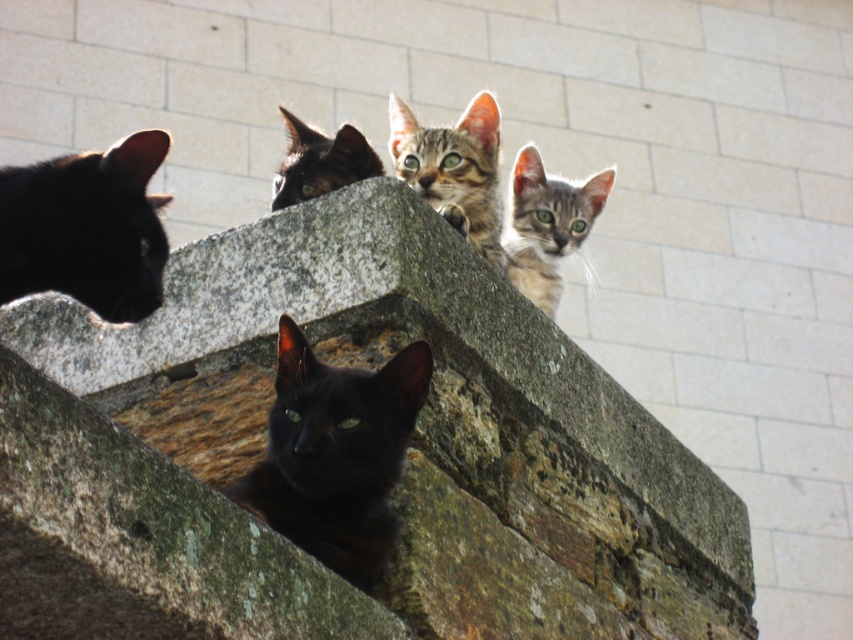
Question: Is black glossy cat at center positioned before shiny black cat at upper center?

Choices:
 (A) no
 (B) yes

Answer: (B)

Question: Estimate the real-world distances between objects in this image. Which object is farther from the shiny black cat at upper center?

Choices:
 (A) tabby fur kitten at upper center
 (B) tabby fur kitten at upper right

Answer: (B)

Question: Which object appears closest to the camera in this image?

Choices:
 (A) black glossy cat at center
 (B) tabby fur kitten at upper center
 (C) tabby fur kitten at upper right

Answer: (A)

Question: Is black glossy cat at center smaller than tabby fur kitten at upper center?

Choices:
 (A) yes
 (B) no

Answer: (A)

Question: Which point is closer to the camera taking this photo?

Choices:
 (A) tap(357, 136)
 (B) tap(67, 196)
 (C) tap(601, 429)
 (D) tap(541, 168)

Answer: (B)

Question: Can you confirm if tabby fur kitten at upper right is positioned to the left of shiny black cat at upper center?

Choices:
 (A) no
 (B) yes

Answer: (A)